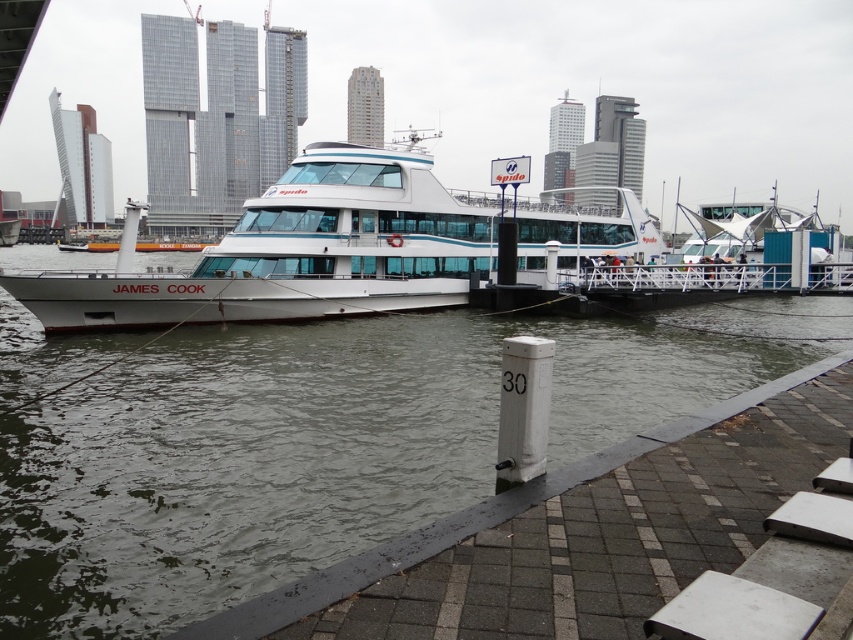
Question: Is clear water at boat left closer to the viewer compared to white glossy ferry at center?

Choices:
 (A) yes
 (B) no

Answer: (A)

Question: Does clear water at boat left have a lesser width compared to white glossy ferry at center?

Choices:
 (A) yes
 (B) no

Answer: (A)

Question: Which object is closer to the camera taking this photo?

Choices:
 (A) white glossy ferry at center
 (B) clear water at boat left

Answer: (B)

Question: Can you confirm if clear water at boat left is positioned above white glossy ferry at center?

Choices:
 (A) yes
 (B) no

Answer: (B)